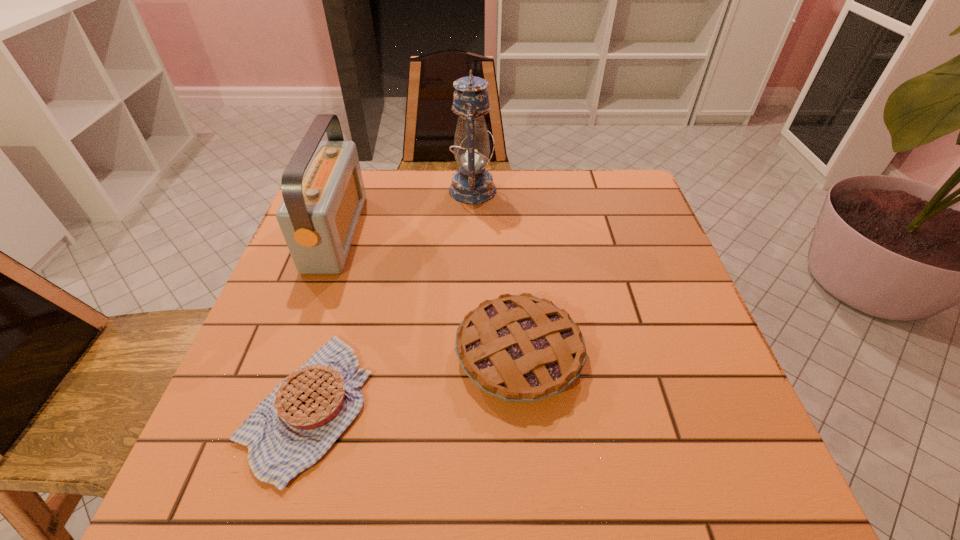
I want to click on lantern, so click(x=472, y=184).

Locate an element on the screen. This screenshot has height=540, width=960. radio receiver is located at coordinates (322, 186).

Locate an element on the screen. The image size is (960, 540). the third tallest object is located at coordinates (520, 348).

The height and width of the screenshot is (540, 960). Find the location of `the taller pie`. the taller pie is located at coordinates (520, 348).

Locate an element on the screen. the shortest object is located at coordinates (290, 430).

This screenshot has height=540, width=960. In order to click on the left pie in this screenshot , I will do `click(290, 430)`.

Where is `free spot located 0.300m on the front-facing side of the lantern`? The height and width of the screenshot is (540, 960). free spot located 0.300m on the front-facing side of the lantern is located at coordinates (601, 190).

This screenshot has width=960, height=540. I want to click on vacant position located 0.060m on the front-facing side of the second tallest object, so click(380, 232).

Image resolution: width=960 pixels, height=540 pixels. I want to click on vacant region located 0.140m on the left of the second shortest object, so click(384, 354).

I want to click on free space located on the right of the shortest object, so click(523, 405).